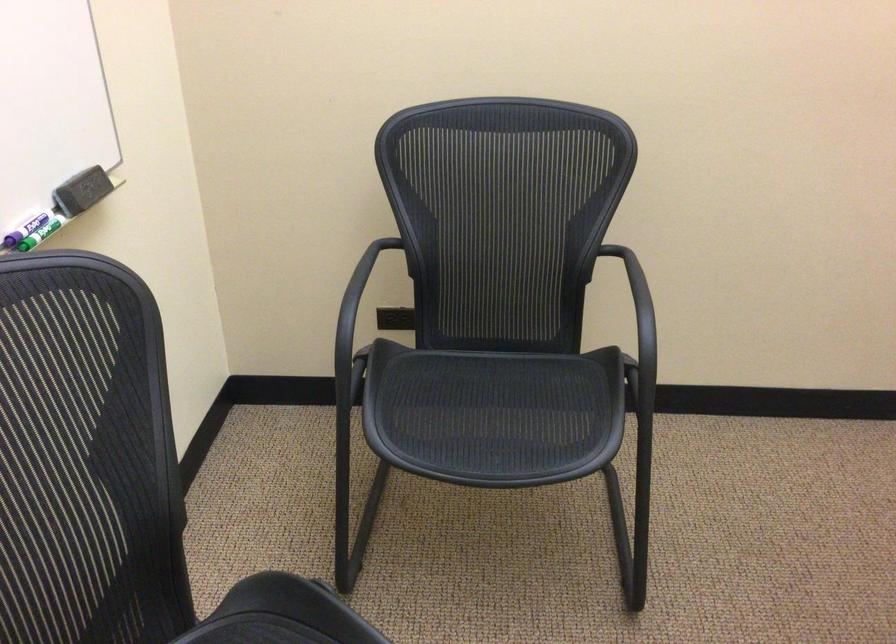
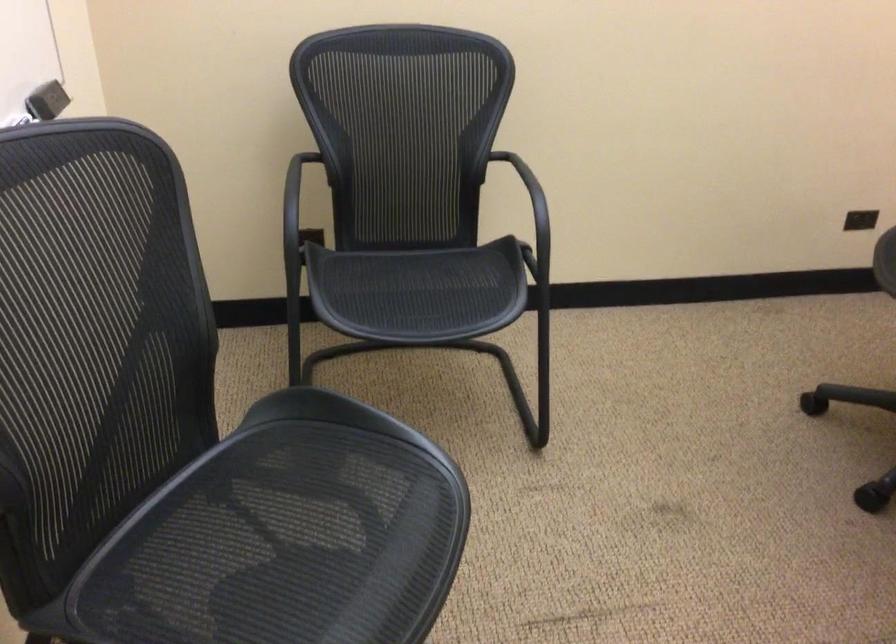
In the second image, find the point that corresponds to the point at 350,303 in the first image.

(298, 201)